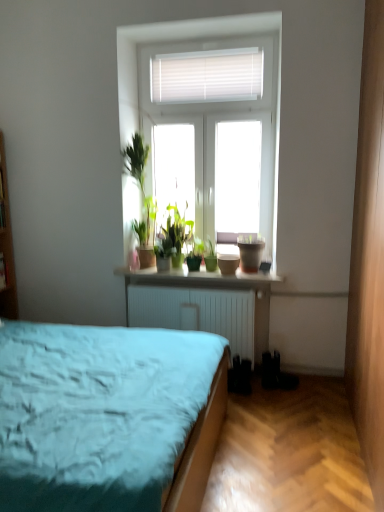
Question: Can you confirm if green matte plant at center, the 1th houseplant when ordered from left to right, is bigger than matte brown flowerpot at window?

Choices:
 (A) no
 (B) yes

Answer: (B)

Question: From a real-world perspective, is green matte plant at center, acting as the second houseplant starting from the right, located beneath matte brown flowerpot at window?

Choices:
 (A) yes
 (B) no

Answer: (B)

Question: Can you confirm if green matte plant at center, the 1th houseplant when ordered from left to right, is positioned to the left of matte brown flowerpot at window?

Choices:
 (A) no
 (B) yes

Answer: (B)

Question: Is green matte plant at center, the 1th houseplant when ordered from left to right, positioned in front of matte brown flowerpot at window?

Choices:
 (A) yes
 (B) no

Answer: (B)

Question: Considering the relative sizes of green matte plant at center, acting as the second houseplant starting from the right, and matte brown flowerpot at window in the image provided, is green matte plant at center, acting as the second houseplant starting from the right, smaller than matte brown flowerpot at window?

Choices:
 (A) yes
 (B) no

Answer: (B)

Question: Is green matte plant at center, which appears as the second houseplant when viewed from the left, inside the boundaries of matte ceramic pots at center, or outside?

Choices:
 (A) inside
 (B) outside

Answer: (B)

Question: In terms of width, does green matte plant at center, which appears as the second houseplant when viewed from the left, look wider or thinner when compared to matte ceramic pots at center?

Choices:
 (A) thin
 (B) wide

Answer: (A)

Question: Considering their positions, is green matte plant at center, marked as the 1th houseplant in a right-to-left arrangement, located in front of or behind matte ceramic pots at center?

Choices:
 (A) behind
 (B) front

Answer: (A)

Question: From the image's perspective, is green matte plant at center, which appears as the second houseplant when viewed from the left, above or below matte ceramic pots at center?

Choices:
 (A) below
 (B) above

Answer: (B)

Question: Based on their sizes in the image, would you say green matte plant at center, the 1th houseplant when ordered from left to right, is bigger or smaller than green matte plant at center, which appears as the second houseplant when viewed from the left?

Choices:
 (A) small
 (B) big

Answer: (B)

Question: Does point (190, 270) appear closer or farther from the camera than point (211, 252)?

Choices:
 (A) farther
 (B) closer

Answer: (B)

Question: Considering the positions of green matte plant at center, acting as the second houseplant starting from the right, and green matte plant at center, marked as the 1th houseplant in a right-to-left arrangement, in the image, is green matte plant at center, acting as the second houseplant starting from the right, wider or thinner than green matte plant at center, marked as the 1th houseplant in a right-to-left arrangement,?

Choices:
 (A) thin
 (B) wide

Answer: (B)

Question: Relative to green matte plant at center, which appears as the second houseplant when viewed from the left, is green matte plant at center, the 1th houseplant when ordered from left to right, in front or behind?

Choices:
 (A) front
 (B) behind

Answer: (A)

Question: In the image, is green matte plant at center, the 1th houseplant when ordered from left to right, on the left side or the right side of matte ceramic pots at center?

Choices:
 (A) right
 (B) left

Answer: (B)

Question: From a real-world perspective, is green matte plant at center, acting as the second houseplant starting from the right, positioned above or below matte ceramic pots at center?

Choices:
 (A) below
 (B) above

Answer: (B)